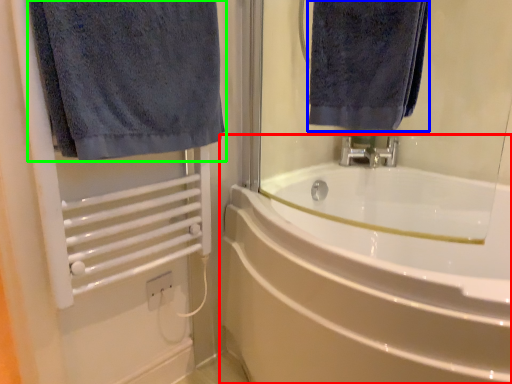
Question: Based on their relative distances, which object is farther from bathtub (highlighted by a red box)? Choose from towel (highlighted by a blue box) and towel (highlighted by a green box).

Choices:
 (A) towel
 (B) towel

Answer: (B)